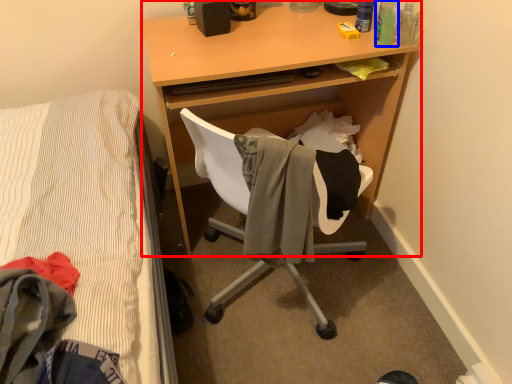
Question: Which point is further to the camera, desk (highlighted by a red box) or bottle (highlighted by a blue box)?

Choices:
 (A) desk
 (B) bottle

Answer: (B)